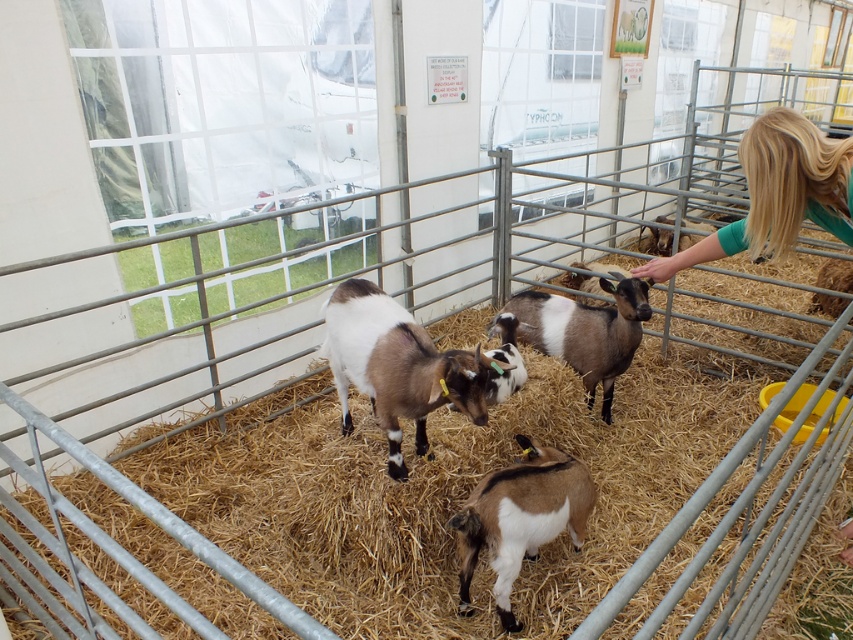
You are a farmer checking the goats in the pen. You notice two distinct features among the goats. Which one is smaller in size between the blonde hair at right and the brown speckled fur at center?

The blonde hair at right is smaller than the brown speckled fur at center.